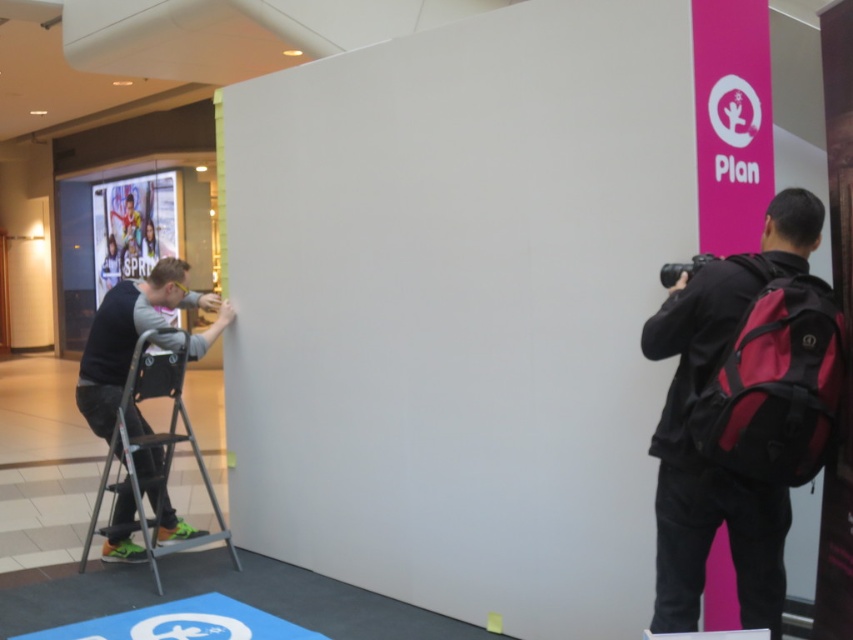
Question: Is black backpack at right in front of metallic silver ladder at left?

Choices:
 (A) yes
 (B) no

Answer: (A)

Question: Which point is farther to the camera?

Choices:
 (A) metallic silver ladder at left
 (B) black backpack at right

Answer: (A)

Question: Among these objects, which one is farthest from the camera?

Choices:
 (A) black backpack at right
 (B) metallic silver ladder at left

Answer: (B)

Question: Which point appears farthest from the camera in this image?

Choices:
 (A) (672, 355)
 (B) (114, 438)

Answer: (B)

Question: Does black backpack at right have a lesser width compared to metallic silver ladder at left?

Choices:
 (A) yes
 (B) no

Answer: (A)

Question: Is black backpack at right to the left of metallic silver ladder at left from the viewer's perspective?

Choices:
 (A) no
 (B) yes

Answer: (A)